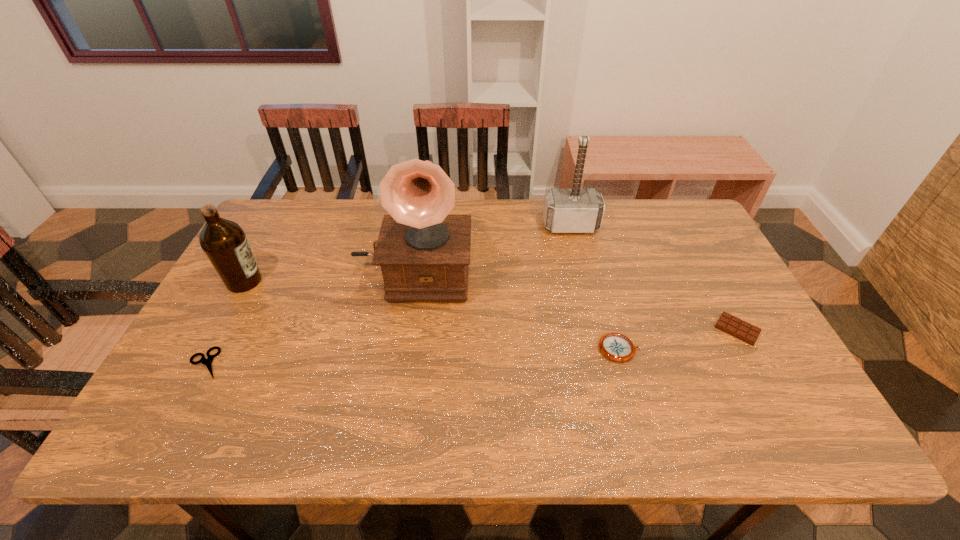
Identify the location of blank space at the far edge of the desktop. (616, 219).

Image resolution: width=960 pixels, height=540 pixels. Find the location of `vacant space at the near edge of the desktop`. vacant space at the near edge of the desktop is located at coordinates (540, 421).

Find the location of `blank space at the left edge`. blank space at the left edge is located at coordinates [223, 311].

Identify the location of vacant space at the right edge. (761, 364).

Where is `vacant area at the far left corner of the desktop`? The image size is (960, 540). vacant area at the far left corner of the desktop is located at coordinates (265, 219).

The width and height of the screenshot is (960, 540). I want to click on vacant space at the far right corner of the desktop, so click(695, 224).

The height and width of the screenshot is (540, 960). What are the coordinates of `vacant area that lies between the shears and the candy bar` in the screenshot? It's located at (471, 346).

Where is `vacant space that's between the rightmost object and the third shortest object`? The image size is (960, 540). vacant space that's between the rightmost object and the third shortest object is located at coordinates (678, 339).

The image size is (960, 540). I want to click on free space between the olive oil and the record player, so tap(328, 277).

This screenshot has height=540, width=960. I want to click on unoccupied position between the shears and the rightmost object, so click(x=471, y=346).